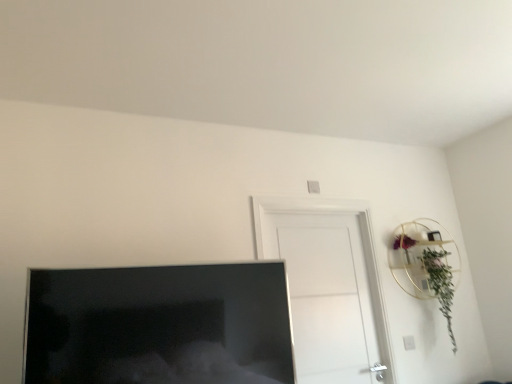
Question: From a real-world perspective, is matte black tv at lower left on top of white matte door at center?

Choices:
 (A) yes
 (B) no

Answer: (B)

Question: Is matte black tv at lower left turned away from white matte door at center?

Choices:
 (A) no
 (B) yes

Answer: (A)

Question: From a real-world perspective, is matte black tv at lower left positioned under white matte door at center based on gravity?

Choices:
 (A) no
 (B) yes

Answer: (B)

Question: Does matte black tv at lower left lie behind white matte door at center?

Choices:
 (A) no
 (B) yes

Answer: (A)

Question: Considering the relative sizes of matte black tv at lower left and white matte door at center in the image provided, is matte black tv at lower left taller than white matte door at center?

Choices:
 (A) yes
 (B) no

Answer: (B)

Question: Does matte black tv at lower left touch white matte door at center?

Choices:
 (A) no
 (B) yes

Answer: (A)

Question: Considering the relative sizes of green leafy plant at upper right and matte black tv at lower left in the image provided, is green leafy plant at upper right taller than matte black tv at lower left?

Choices:
 (A) yes
 (B) no

Answer: (A)

Question: From the image's perspective, is green leafy plant at upper right above matte black tv at lower left?

Choices:
 (A) no
 (B) yes

Answer: (A)

Question: Can we say green leafy plant at upper right lies outside matte black tv at lower left?

Choices:
 (A) yes
 (B) no

Answer: (A)

Question: Considering the relative sizes of green leafy plant at upper right and matte black tv at lower left in the image provided, is green leafy plant at upper right wider than matte black tv at lower left?

Choices:
 (A) no
 (B) yes

Answer: (B)

Question: Is matte black tv at lower left located within green leafy plant at upper right?

Choices:
 (A) yes
 (B) no

Answer: (B)

Question: Is green leafy plant at upper right at the left side of matte black tv at lower left?

Choices:
 (A) yes
 (B) no

Answer: (B)

Question: Can you confirm if matte black tv at lower left is positioned to the right of green leafy plant at upper right?

Choices:
 (A) yes
 (B) no

Answer: (B)